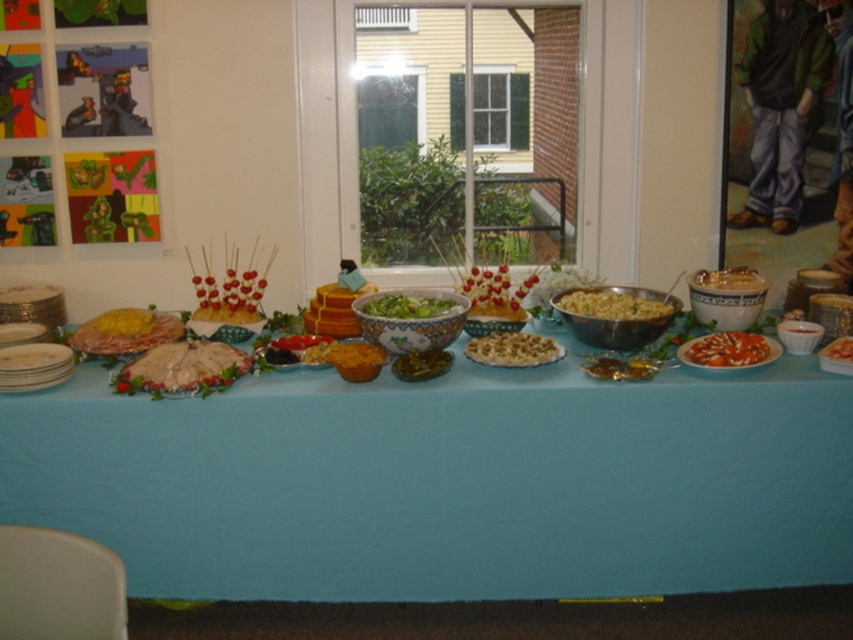
You are at the buffet table and want to grab a slice of the brown crumbly pie at center. Based on its position, which direction should you move to reach it from your current spot at the left side of the table?

The brown crumbly pie at center is located at point coordinates, so you should move to the right from the left side of the table to reach it.

You are setting up a buffet table and need to place a new dish on the table. The dish requires a space larger than the matte ceramic bowl at center. Is there enough space on the blue fabric tablecloth at center to accommodate it?

The blue fabric tablecloth at center is bigger than the matte ceramic bowl at center, so yes, there is enough space on the blue fabric tablecloth at center to accommodate the dish requiring a space larger than the matte ceramic bowl at center.